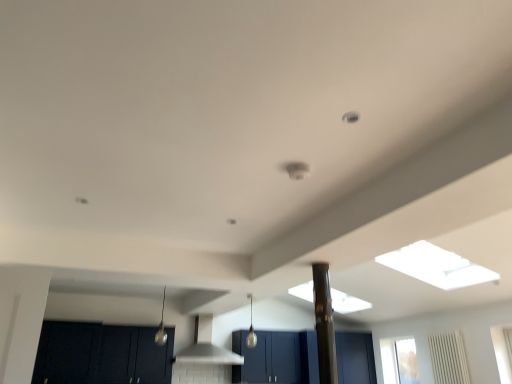
Question: From the image's perspective, is black glossy pillar at center located beneath dark wood cabinet at lower left, the first cabinetry positioned from the left?

Choices:
 (A) no
 (B) yes

Answer: (A)

Question: Is black glossy pillar at center bigger than dark wood cabinet at lower left, the first cabinetry positioned from the left?

Choices:
 (A) no
 (B) yes

Answer: (A)

Question: Is black glossy pillar at center turned away from dark wood cabinet at lower left, the first cabinetry positioned from the left?

Choices:
 (A) yes
 (B) no

Answer: (B)

Question: Is black glossy pillar at center positioned behind dark wood cabinet at lower left, the first cabinetry positioned from the left?

Choices:
 (A) no
 (B) yes

Answer: (A)

Question: Is black glossy pillar at center closer to camera compared to dark wood cabinet at lower left, the first cabinetry positioned from the left?

Choices:
 (A) no
 (B) yes

Answer: (B)

Question: Is black glossy pillar at center located outside dark wood cabinet at lower left, the first cabinetry positioned from the left?

Choices:
 (A) no
 (B) yes

Answer: (B)

Question: From the image's perspective, is matte black cabinets at lower left, positioned as the 2th cabinetry in left-to-right order, on black glossy pillar at center?

Choices:
 (A) no
 (B) yes

Answer: (A)

Question: From a real-world perspective, is matte black cabinets at lower left, positioned as the 2th cabinetry in left-to-right order, on top of black glossy pillar at center?

Choices:
 (A) no
 (B) yes

Answer: (A)

Question: Considering the relative sizes of matte black cabinets at lower left, the second cabinetry positioned from the right, and black glossy pillar at center in the image provided, is matte black cabinets at lower left, the second cabinetry positioned from the right, wider than black glossy pillar at center?

Choices:
 (A) yes
 (B) no

Answer: (A)

Question: Is matte black cabinets at lower left, positioned as the 2th cabinetry in left-to-right order, with black glossy pillar at center?

Choices:
 (A) no
 (B) yes

Answer: (A)

Question: Can you confirm if matte black cabinets at lower left, the second cabinetry positioned from the right, is positioned to the left of black glossy pillar at center?

Choices:
 (A) yes
 (B) no

Answer: (A)

Question: Can you confirm if matte black cabinets at lower left, the second cabinetry positioned from the right, is thinner than black glossy pillar at center?

Choices:
 (A) no
 (B) yes

Answer: (A)

Question: Does black glossy pillar at center have a lesser width compared to white matte vent at center?

Choices:
 (A) no
 (B) yes

Answer: (B)